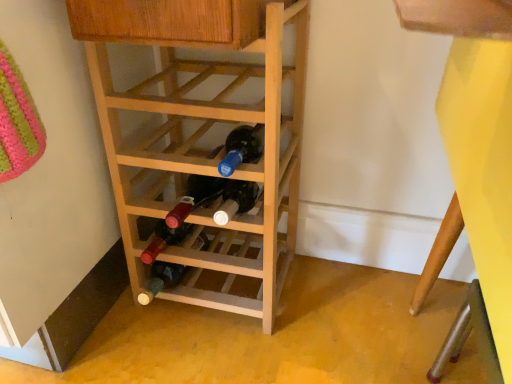
Identify the location of free point in front of natural wood wine rack at center. Image resolution: width=512 pixels, height=384 pixels. (220, 350).